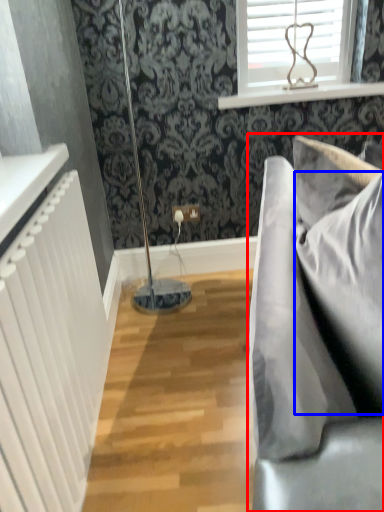
Question: Which of the following is the closest to the observer, studio couch (highlighted by a red box) or pillow (highlighted by a blue box)?

Choices:
 (A) studio couch
 (B) pillow

Answer: (A)